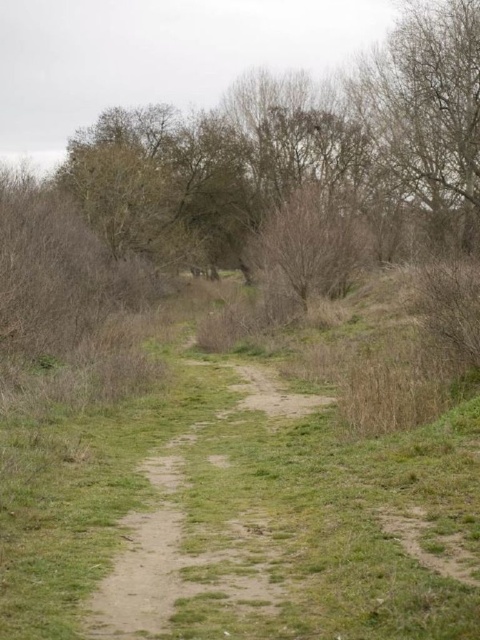
You are standing at the point closer to the camera along the dirt path. Which point are you standing on, point (x=157, y=502) or point (x=180, y=550)?

You are standing on point (x=157, y=502) because it is closer to the camera than point (x=180, y=550).